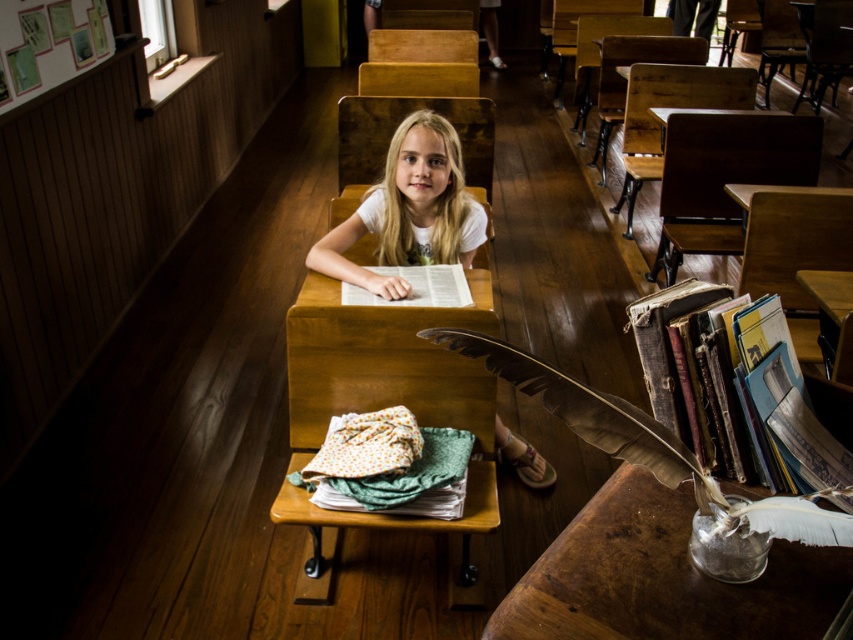
You are a student in the classroom and need to reach the hardcover books at right from your position near the white matte shirt at center. Which direction should you move to get there?

You should move to the right since the hardcover books at right are located to the right of the white matte shirt at center.

You are standing in the classroom and want to place a small decorative item exactly at the center of the white matte shirt at center. According to the coordinates provided, where should you place it?

The white matte shirt at center is located at coordinates point (409,211), so you should place the decorative item at that exact point.

You are a student sitting at the desk with the quill pen and inkwell. You notice a point marked at coordinates (409, 211) in the image. What object is this point located on?

The point at coordinates (409, 211) is on the white matte shirt at center.